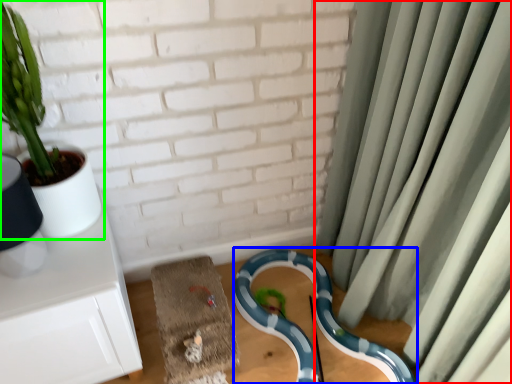
Question: Based on their relative distances, which object is nearer to curtain (highlighted by a red box)? Choose from snake (highlighted by a blue box) and houseplant (highlighted by a green box).

Choices:
 (A) snake
 (B) houseplant

Answer: (A)